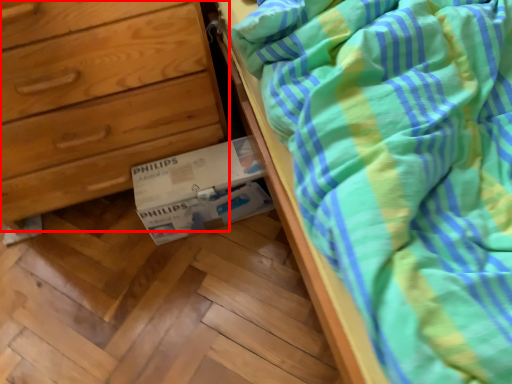
Question: From the image's perspective, what is the correct spatial positioning of chest of drawers (annotated by the red box) in reference to cardboard box?

Choices:
 (A) above
 (B) below

Answer: (A)